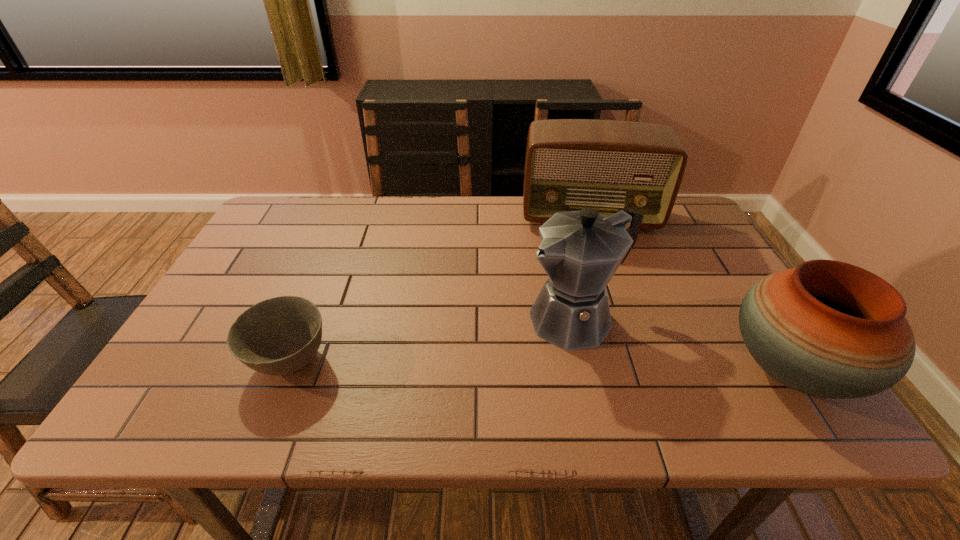
The image size is (960, 540). I want to click on vacant space located on the front-facing side of the farthest object, so click(589, 249).

The height and width of the screenshot is (540, 960). What are the coordinates of `free space located on the front-facing side of the farthest object` in the screenshot? It's located at (601, 338).

Where is `blank space located 0.080m on the front-facing side of the farthest object`? blank space located 0.080m on the front-facing side of the farthest object is located at coordinates (590, 254).

Identify the location of object that is at the far edge. (608, 165).

The height and width of the screenshot is (540, 960). I want to click on bowl present at the near edge, so [x=278, y=336].

What are the coordinates of `pottery located at the near edge` in the screenshot? It's located at (826, 328).

At what (x,y) coordinates should I click in order to perform the action: click on object that is at the left edge. Please return your answer as a coordinate pair (x, y). The image size is (960, 540). Looking at the image, I should click on (278, 336).

I want to click on pottery positioned at the right edge, so click(x=826, y=328).

At what (x,y) coordinates should I click in order to perform the action: click on radio receiver that is at the right edge. Please return your answer as a coordinate pair (x, y). The height and width of the screenshot is (540, 960). Looking at the image, I should click on (608, 165).

Where is `object at the near left corner`? object at the near left corner is located at coordinates (278, 336).